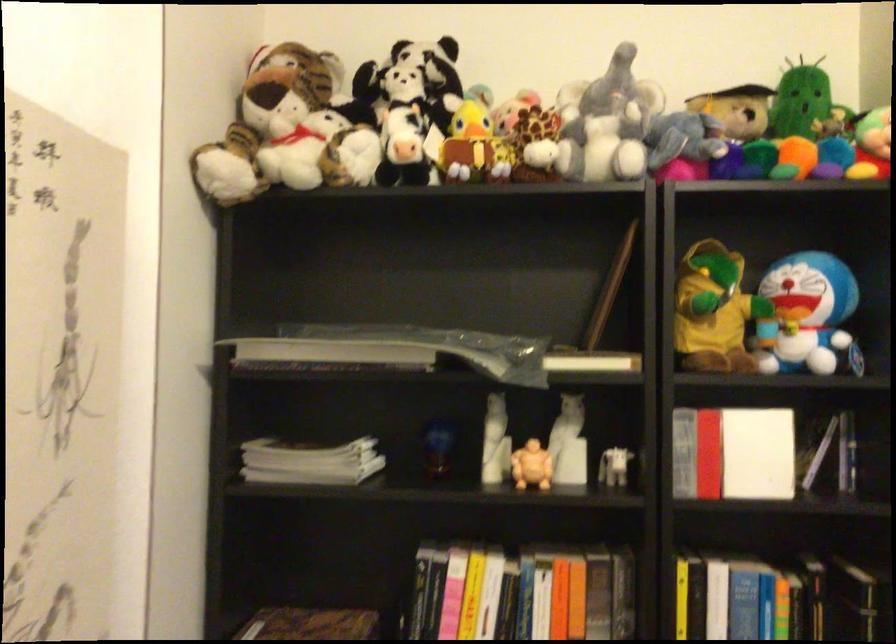
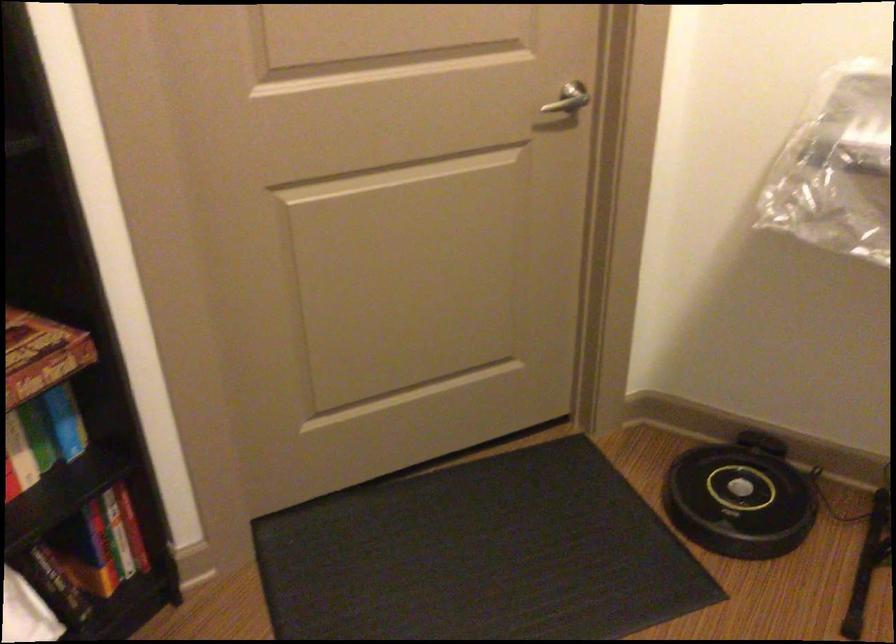
In the scene shown: The images are taken continuously from a first-person perspective. In which direction is your viewpoint rotating?

The camera's rotation is toward right-down.